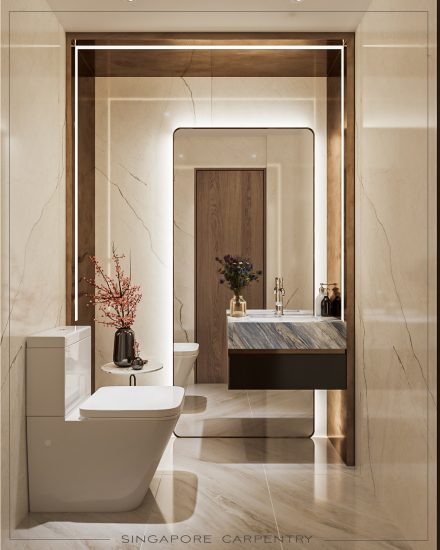
Find the location of a particular element. Image resolution: width=440 pixels, height=550 pixels. bathroom sink is located at coordinates (290, 335).